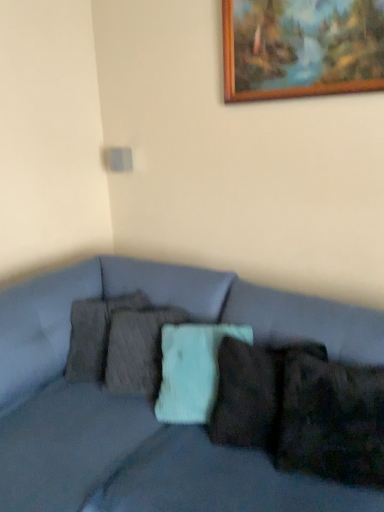
Question: Considering the relative sizes of matte gray couch at center and wooden picture frame at upper center in the image provided, is matte gray couch at center shorter than wooden picture frame at upper center?

Choices:
 (A) yes
 (B) no

Answer: (B)

Question: Considering the relative positions of matte gray couch at center and wooden picture frame at upper center in the image provided, is matte gray couch at center behind wooden picture frame at upper center?

Choices:
 (A) yes
 (B) no

Answer: (B)

Question: From the image's perspective, is matte gray couch at center beneath wooden picture frame at upper center?

Choices:
 (A) yes
 (B) no

Answer: (A)

Question: Does matte gray couch at center have a smaller size compared to wooden picture frame at upper center?

Choices:
 (A) no
 (B) yes

Answer: (A)

Question: Is matte gray couch at center at the right side of wooden picture frame at upper center?

Choices:
 (A) yes
 (B) no

Answer: (B)

Question: From a real-world perspective, is wooden picture frame at upper center above or below textured gray pillow at center, positioned as the first pillow in back-to-front order?

Choices:
 (A) below
 (B) above

Answer: (B)

Question: Is point (264, 10) closer or farther from the camera than point (147, 303)?

Choices:
 (A) closer
 (B) farther

Answer: (A)

Question: Is wooden picture frame at upper center bigger or smaller than textured gray pillow at center, the 2th pillow positioned from the front?

Choices:
 (A) big
 (B) small

Answer: (B)

Question: Relative to textured gray pillow at center, the 2th pillow positioned from the front, is wooden picture frame at upper center in front or behind?

Choices:
 (A) front
 (B) behind

Answer: (A)

Question: In the image, is velvety brown pillow at lower right, the 2th pillow in the left-to-right sequence, positioned in front of or behind wooden picture frame at upper center?

Choices:
 (A) front
 (B) behind

Answer: (A)

Question: From a real-world perspective, is velvety brown pillow at lower right, the 2th pillow in the left-to-right sequence, physically located above or below wooden picture frame at upper center?

Choices:
 (A) below
 (B) above

Answer: (A)

Question: From their relative heights in the image, would you say velvety brown pillow at lower right, the 2th pillow in the left-to-right sequence, is taller or shorter than wooden picture frame at upper center?

Choices:
 (A) tall
 (B) short

Answer: (B)

Question: Considering the positions of velvety brown pillow at lower right, positioned as the 1th pillow in right-to-left order, and wooden picture frame at upper center in the image, is velvety brown pillow at lower right, positioned as the 1th pillow in right-to-left order, wider or thinner than wooden picture frame at upper center?

Choices:
 (A) thin
 (B) wide

Answer: (B)

Question: In terms of width, does matte gray couch at center look wider or thinner when compared to wooden picture frame at upper center?

Choices:
 (A) wide
 (B) thin

Answer: (A)

Question: In the image, is matte gray couch at center positioned in front of or behind wooden picture frame at upper center?

Choices:
 (A) behind
 (B) front

Answer: (B)